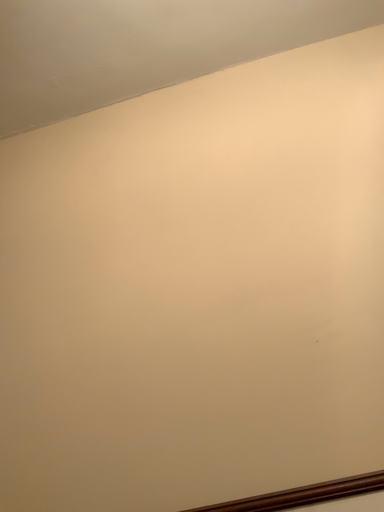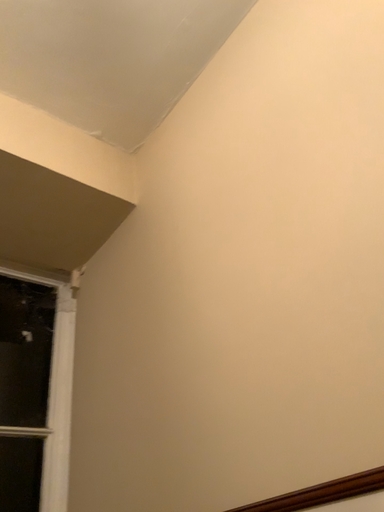
Question: How did the camera likely rotate when shooting the video?

Choices:
 (A) rotated right
 (B) rotated left

Answer: (B)